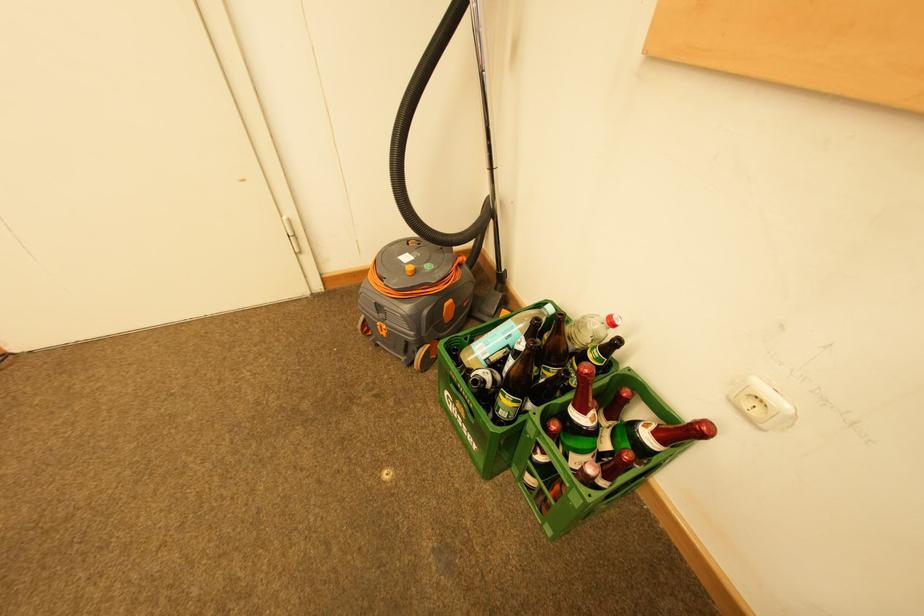
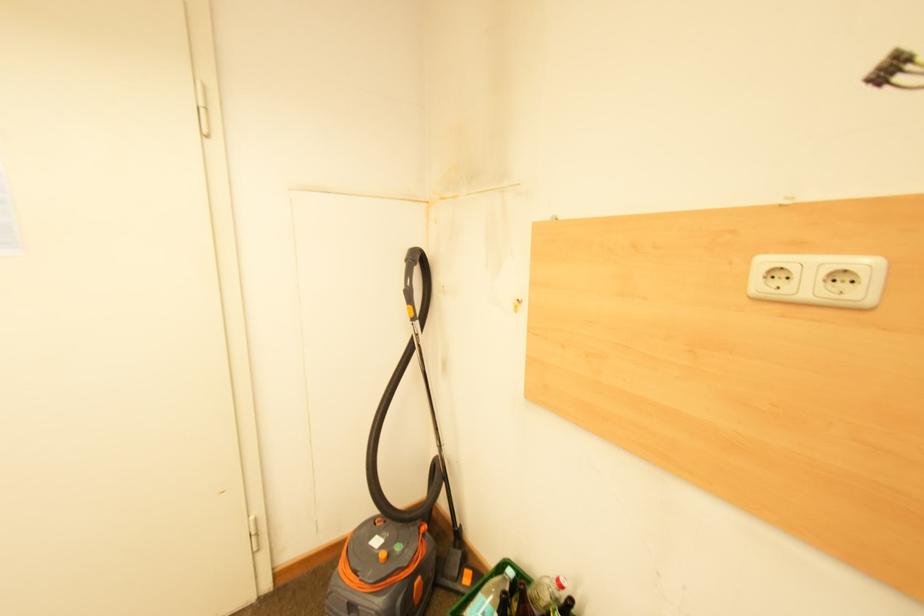
First-person continuous shooting, in which direction is the camera rotating?

The camera rotated toward right-up.